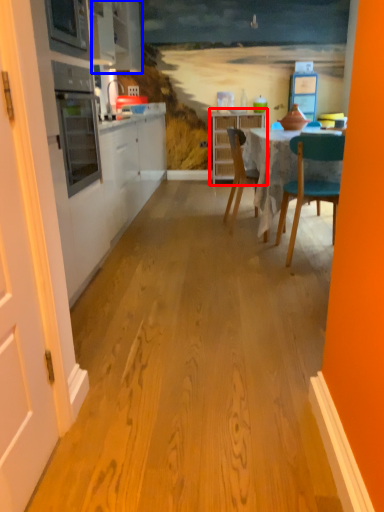
Question: Which object appears farthest to the camera in this image, cabinetry (highlighted by a red box) or cabinetry (highlighted by a blue box)?

Choices:
 (A) cabinetry
 (B) cabinetry

Answer: (A)